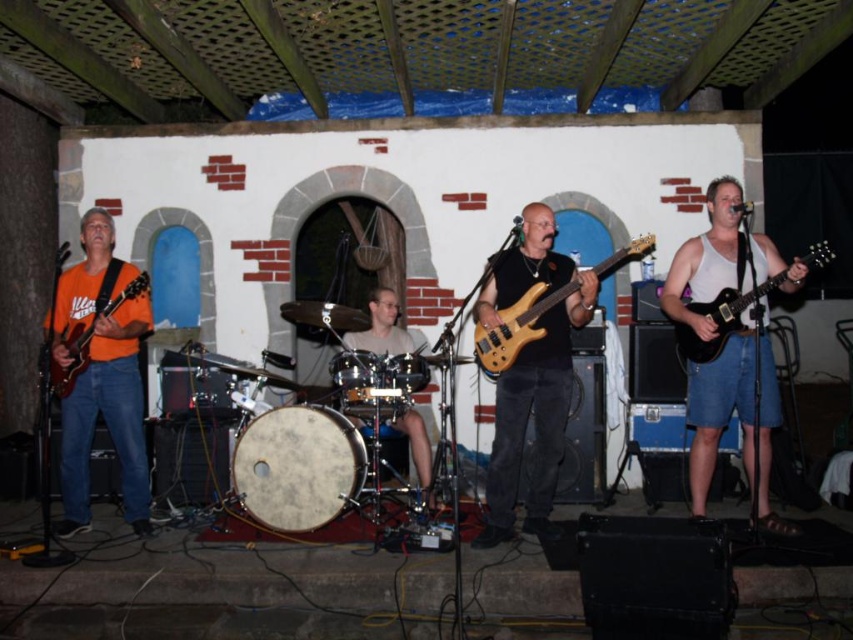
Is white tank top at right thinner than matte orange guitar at left?

Incorrect, white tank top at right's width is not less than matte orange guitar at left's.

Is white tank top at right below matte orange guitar at left?

Yes.

Image resolution: width=853 pixels, height=640 pixels. What do you see at coordinates (721, 260) in the screenshot? I see `white tank top at right` at bounding box center [721, 260].

Where is `white tank top at right`? white tank top at right is located at coordinates (721, 260).

Between white tank top at right and wooden electric bass at center, which one appears on the right side from the viewer's perspective?

From the viewer's perspective, white tank top at right appears more on the right side.

Looking at this image, is white tank top at right positioned at the back of wooden electric bass at center?

No, white tank top at right is in front of wooden electric bass at center.

Between point (705, 488) and point (554, 301), which one is positioned behind?

Positioned behind is point (705, 488).

Image resolution: width=853 pixels, height=640 pixels. What are the coordinates of `white tank top at right` in the screenshot? It's located at (721, 260).

Does matte wood bass guitar at center have a lesser height compared to wooden electric bass at center?

No.

Is matte wood bass guitar at center positioned before wooden electric bass at center?

Yes, matte wood bass guitar at center is in front of wooden electric bass at center.

Who is more forward, (x=520, y=397) or (x=506, y=360)?

Point (x=506, y=360)

Find the location of a particular element. matte wood bass guitar at center is located at coordinates (531, 376).